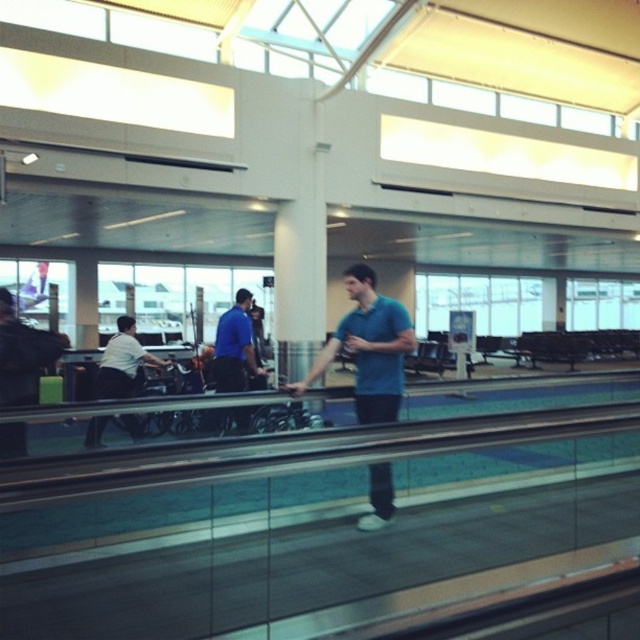
Which is more to the left, blue matte shirt at center or white shirt at left?

Positioned to the left is white shirt at left.

Consider the image. Can you confirm if blue matte shirt at center is positioned below white shirt at left?

Actually, blue matte shirt at center is above white shirt at left.

Is point (384, 387) behind point (115, 394)?

No, (384, 387) is in front of (115, 394).

You are a GUI agent. You are given a task and a screenshot of the screen. Output one action in this format:
    pyautogui.click(x=<x>, y=<y>)
    Task: Click on the blue matte shirt at center
    The height and width of the screenshot is (640, 640).
    Given the screenshot: What is the action you would take?
    pyautogui.click(x=369, y=348)

Who is taller, blue smooth shirt at center or white shirt at left?

With more height is white shirt at left.

Between blue smooth shirt at center and white shirt at left, which one has less height?

blue smooth shirt at center is shorter.

Is point (221, 323) behind point (100, 381)?

No, it is not.

At what (x,y) coordinates should I click in order to perform the action: click on blue smooth shirt at center. Please return your answer as a coordinate pair (x, y). Image resolution: width=640 pixels, height=640 pixels. Looking at the image, I should click on (234, 346).

Who is more distant from viewer, (387, 353) or (237, 380)?

Point (237, 380)

Can you confirm if blue matte shirt at center is positioned to the right of blue smooth shirt at center?

Indeed, blue matte shirt at center is positioned on the right side of blue smooth shirt at center.

Does point (394, 374) lie behind point (248, 320)?

That is False.

I want to click on blue matte shirt at center, so click(x=369, y=348).